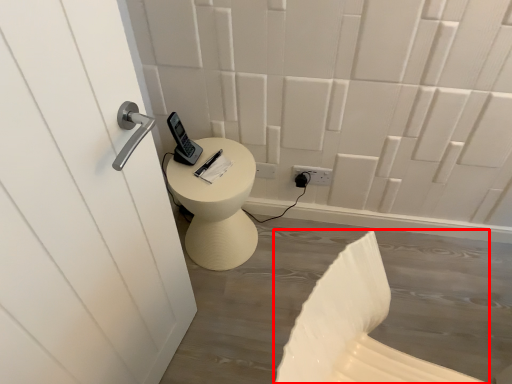
Question: From the image's perspective, what is the correct spatial positioning of swivel chair (annotated by the red box) in reference to electric outlet?

Choices:
 (A) below
 (B) above

Answer: (A)